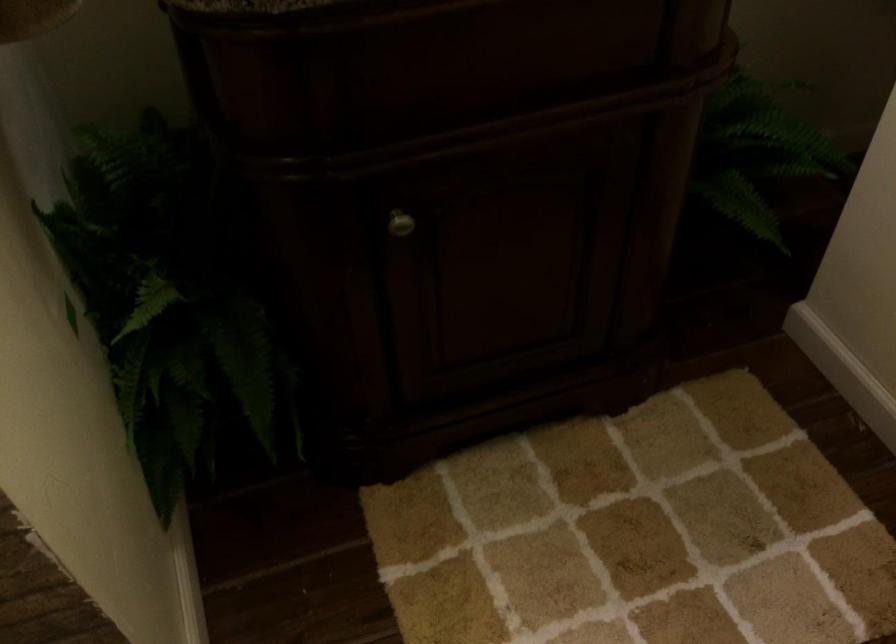
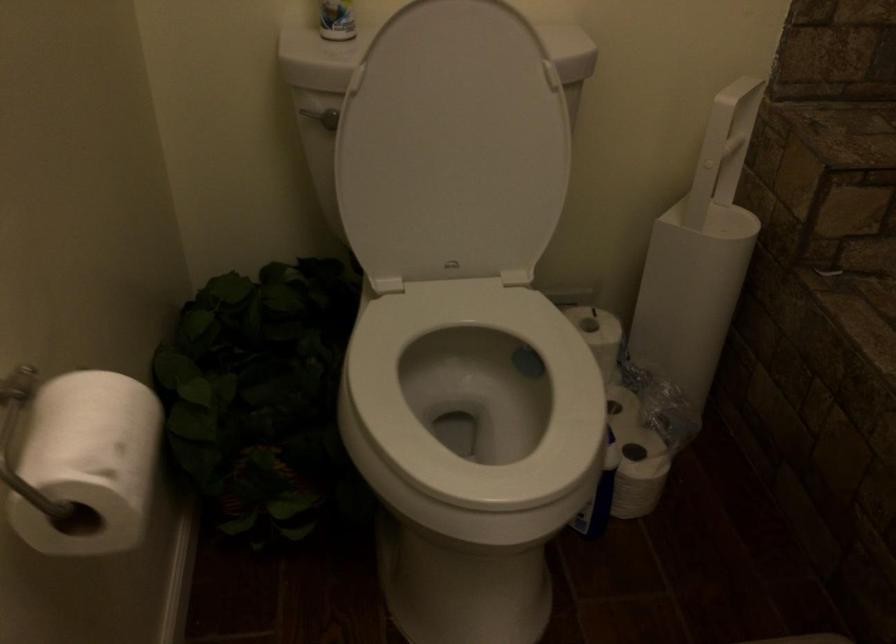
From the picture: Based on the continuous images, in which direction is the camera rotating?

The camera rotated toward left-down.